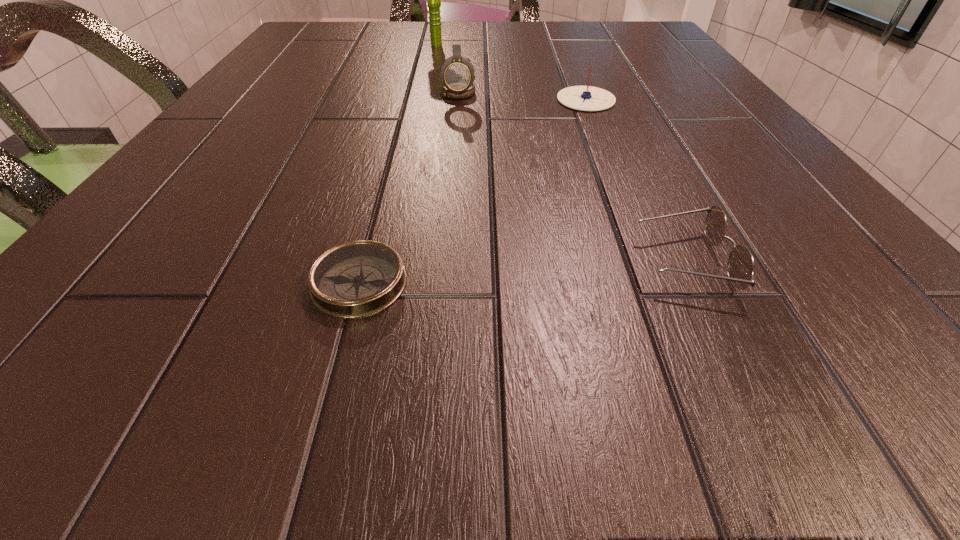
At what (x,y) coordinates should I click in order to perform the action: click on microphone. Please return your answer as a coordinate pair (x, y). Image resolution: width=960 pixels, height=540 pixels. Looking at the image, I should click on (433, 0).

Where is `the farthest object`? The height and width of the screenshot is (540, 960). the farthest object is located at coordinates (433, 0).

You are a GUI agent. You are given a task and a screenshot of the screen. Output one action in this format:
    pyautogui.click(x=<x>, y=<y>)
    Task: Click on the fourth shortest object
    
    Given the screenshot: What is the action you would take?
    [x=457, y=73]

Where is `the third object from left to right`? Image resolution: width=960 pixels, height=540 pixels. the third object from left to right is located at coordinates (457, 73).

You are a GUI agent. You are given a task and a screenshot of the screen. Output one action in this format:
    pyautogui.click(x=<x>, y=<y>)
    Task: Click on the second shortest compass
    This screenshot has height=540, width=960.
    Given the screenshot: What is the action you would take?
    pyautogui.click(x=586, y=98)

You are a GUI agent. You are given a task and a screenshot of the screen. Output one action in this format:
    pyautogui.click(x=<x>, y=<y>)
    Task: Click on the rightmost compass
    
    Given the screenshot: What is the action you would take?
    pyautogui.click(x=586, y=98)

Locate an element on the screen. This screenshot has width=960, height=540. the second shortest object is located at coordinates (740, 266).

Image resolution: width=960 pixels, height=540 pixels. I want to click on the leftmost compass, so click(357, 279).

Identify the location of the shortest compass. The width and height of the screenshot is (960, 540). (357, 279).

This screenshot has width=960, height=540. Find the location of `vacant space located 0.320m on the left of the microphone`. vacant space located 0.320m on the left of the microphone is located at coordinates (288, 44).